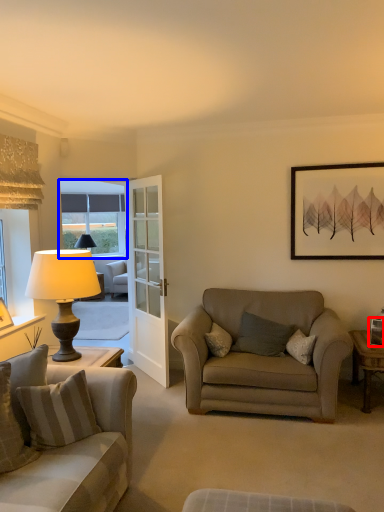
Question: Which point is further to the camera, picture frame (highlighted by a red box) or window (highlighted by a blue box)?

Choices:
 (A) picture frame
 (B) window

Answer: (B)